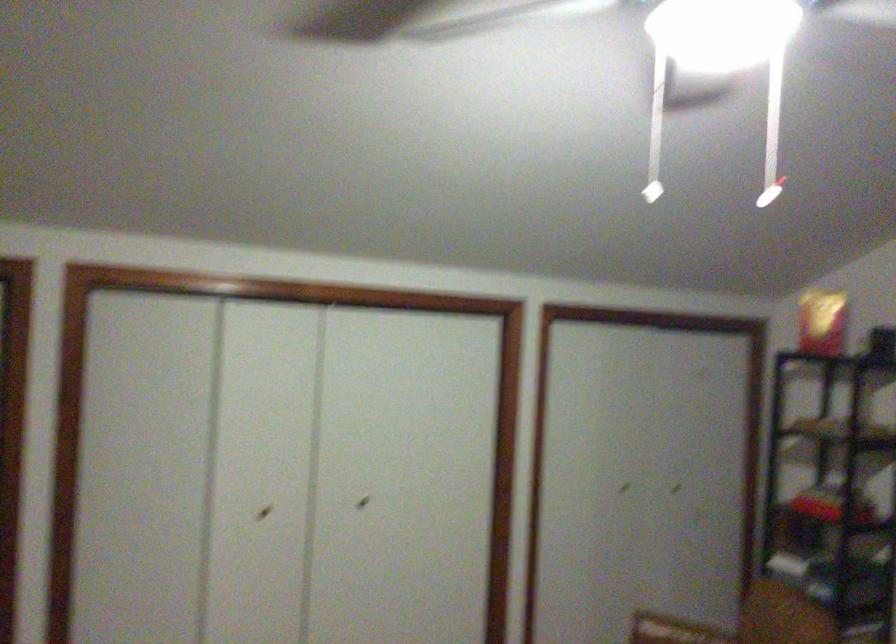
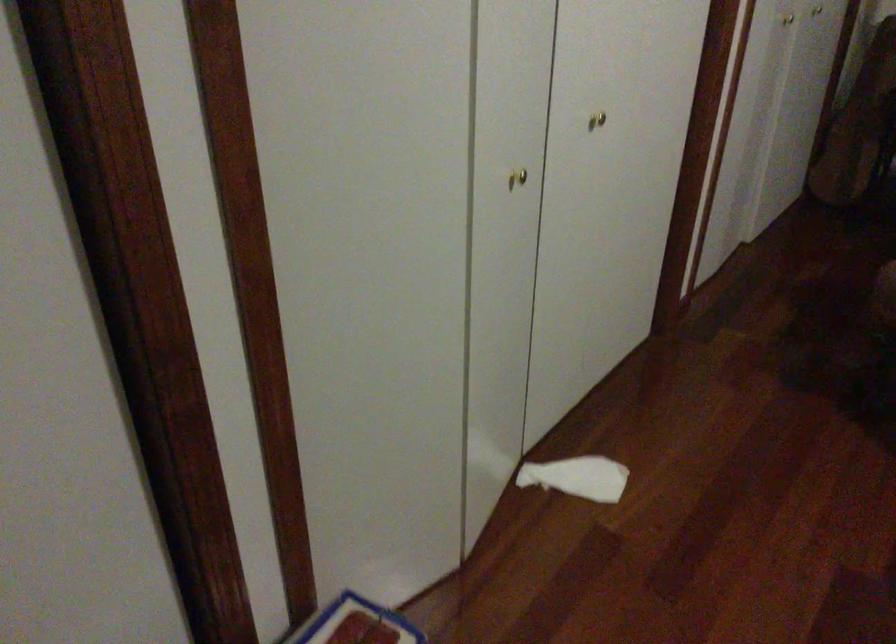
Find the pixel in the second image that matches [261,512] in the first image.

(517, 178)